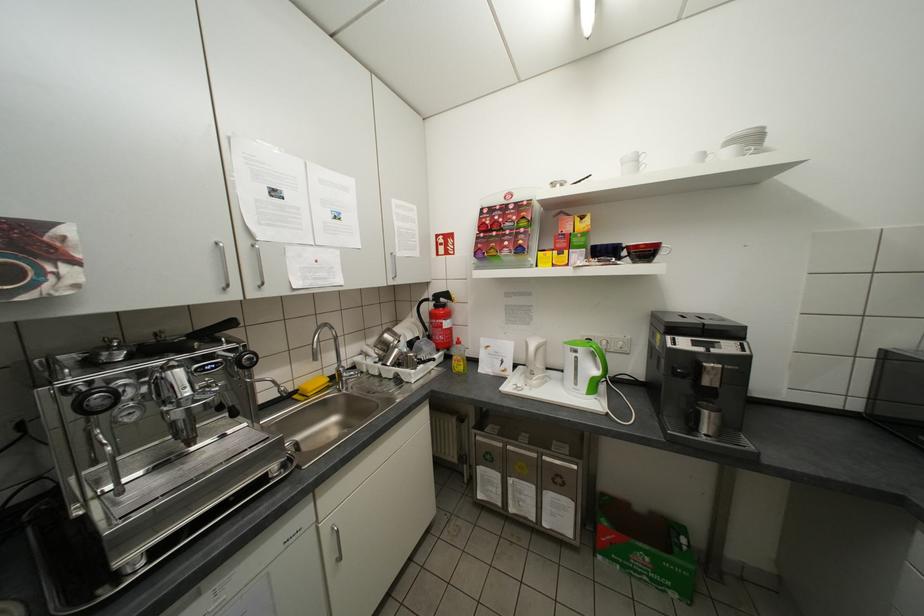
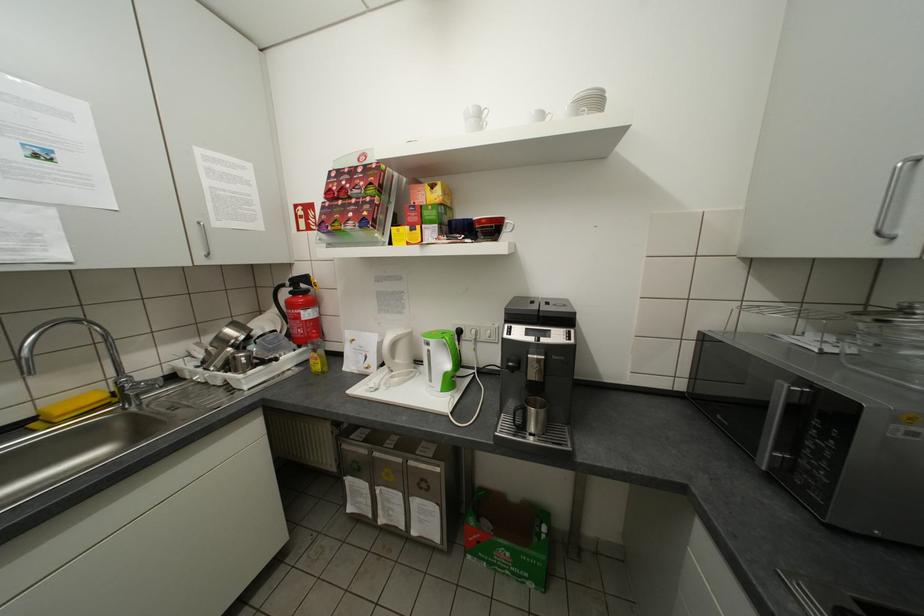
Locate, in the second image, the point that corresponds to (580,538) in the first image.

(448, 543)